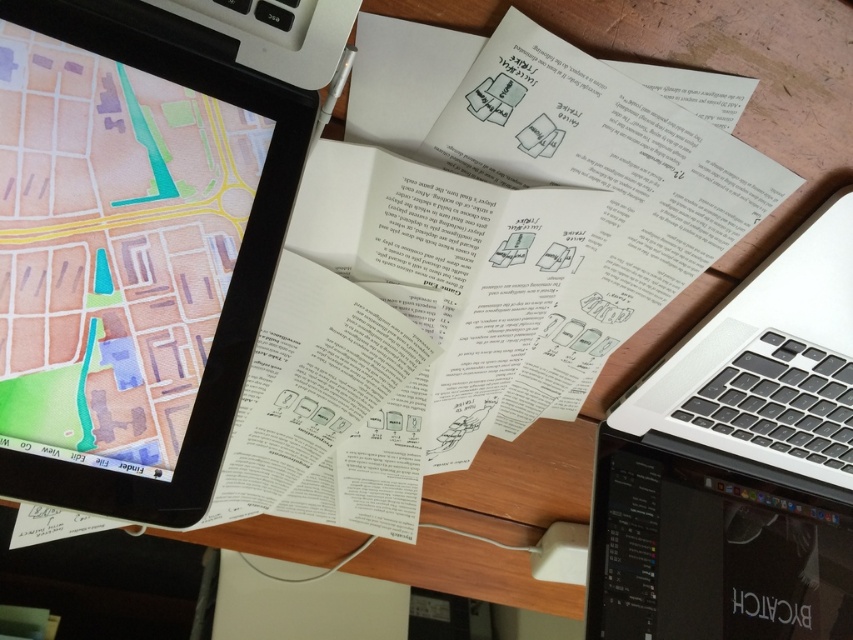
Question: Which point is closer to the camera?

Choices:
 (A) black glossy tablet at upper left
 (B) silver metallic laptop at right
 (C) black glossy tablet at lower right

Answer: (A)

Question: Does black glossy tablet at upper left have a larger size compared to silver metallic laptop at right?

Choices:
 (A) yes
 (B) no

Answer: (B)

Question: Is black glossy tablet at lower right smaller than silver metallic laptop at right?

Choices:
 (A) no
 (B) yes

Answer: (B)

Question: Among these points, which one is nearest to the camera?

Choices:
 (A) (786, 273)
 (B) (7, 406)
 (C) (587, 614)

Answer: (B)

Question: Which point is closer to the camera?

Choices:
 (A) black glossy tablet at lower right
 (B) silver metallic laptop at right

Answer: (B)

Question: Is black glossy tablet at upper left bigger than silver metallic laptop at right?

Choices:
 (A) no
 (B) yes

Answer: (A)